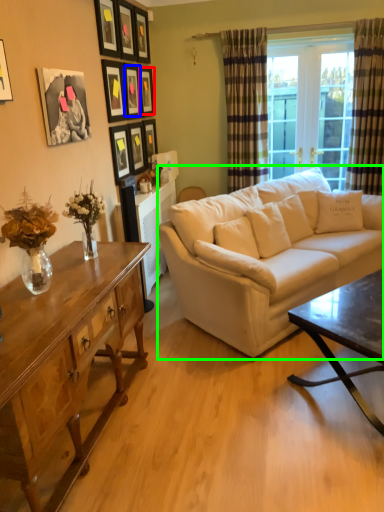
Question: Based on their relative distances, which object is farther from picture frame (highlighted by a red box)? Choose from picture frame (highlighted by a blue box) and studio couch (highlighted by a green box).

Choices:
 (A) picture frame
 (B) studio couch

Answer: (B)